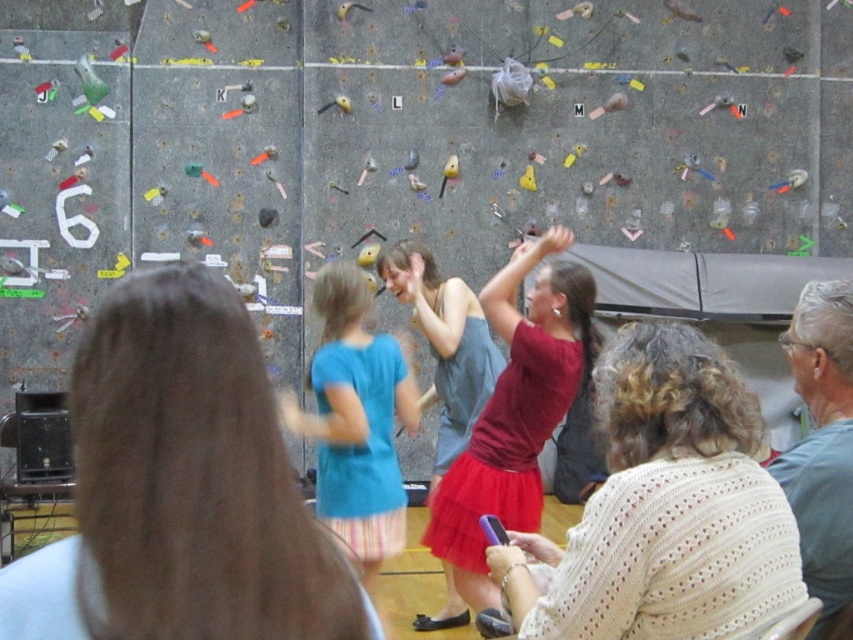
Which of these two, matte red skirt at center or blue cotton shirt at center, stands shorter?

With less height is blue cotton shirt at center.

Does point (554, 268) come in front of point (380, 356)?

Yes, point (554, 268) is in front of point (380, 356).

Is point (500, 275) more distant than point (358, 502)?

Yes, point (500, 275) is behind point (358, 502).

Locate an element on the screen. This screenshot has height=640, width=853. matte red skirt at center is located at coordinates (515, 412).

Looking at this image, is matte red skirt at center smaller than gray fabric at upper right?

No, matte red skirt at center is not smaller than gray fabric at upper right.

From the picture: Does matte red skirt at center have a lesser width compared to gray fabric at upper right?

No.

Locate an element on the screen. This screenshot has width=853, height=640. matte red skirt at center is located at coordinates (515, 412).

Identify the location of matte red skirt at center. The image size is (853, 640). (515, 412).

Is blue cotton shirt at center above gray fabric at upper right?

No.

You are a GUI agent. You are given a task and a screenshot of the screen. Output one action in this format:
    pyautogui.click(x=<x>, y=<y>)
    Task: Click on the blue cotton shirt at center
    
    Given the screenshot: What is the action you would take?
    pyautogui.click(x=355, y=420)